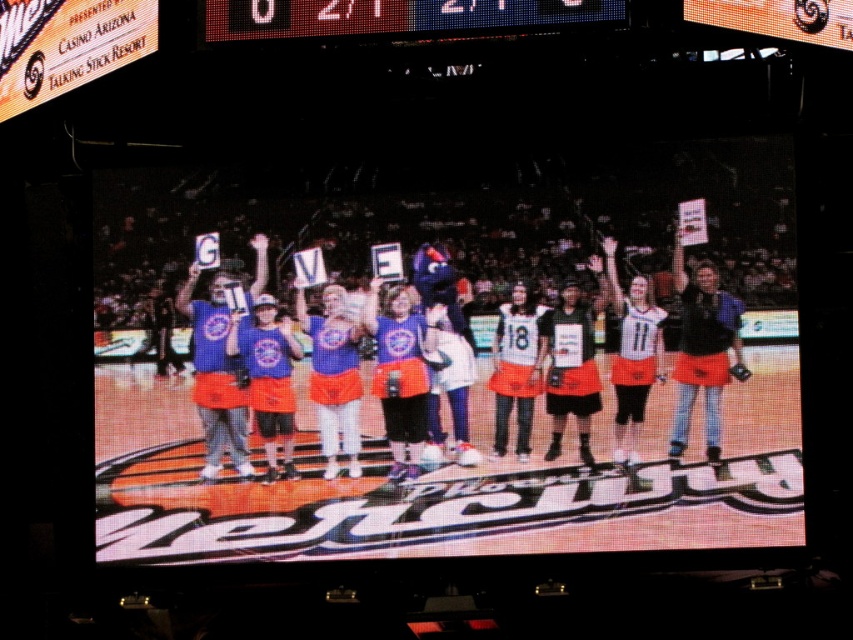
You are a photographer standing at the edge of the basketball court. You want to take a photo of the blue jersey at center and the led digital display at upper center in the same frame. Given that your camera has a maximum focus range of 17 meters, will both subjects be in focus?

The distance between the blue jersey at center and the led digital display at upper center is 17.49 meters. Since the camera can only focus up to 17 meters, the subjects are slightly out of the focus range, so they might not both be in focus.